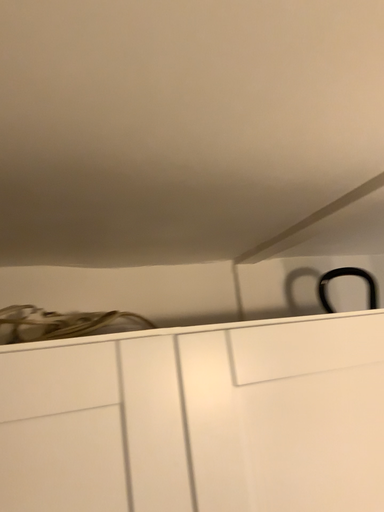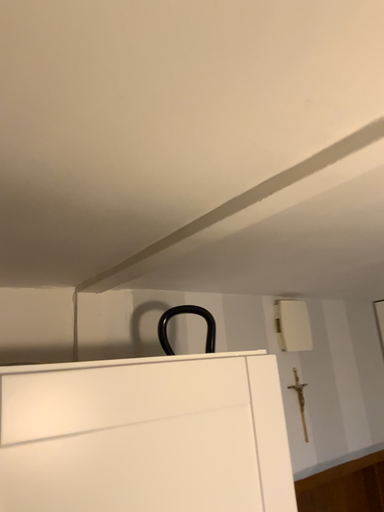
Question: How did the camera likely rotate when shooting the video?

Choices:
 (A) rotated left
 (B) rotated right

Answer: (B)